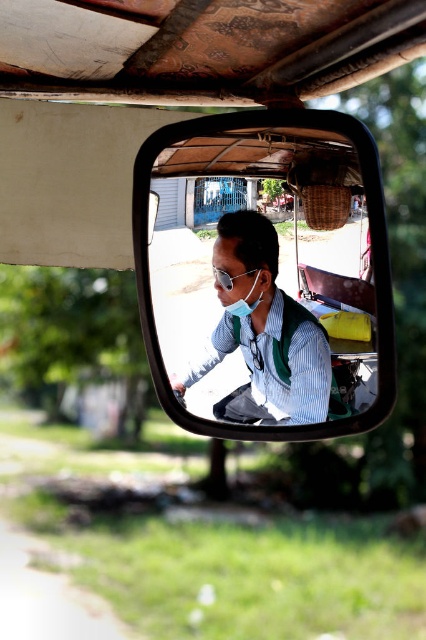
Who is more forward, (232, 310) or (229, 275)?

Point (232, 310) is more forward.

This screenshot has width=426, height=640. In order to click on green fabric mask at center in this screenshot , I will do `click(232, 288)`.

Can you confirm if clear plastic mirror at center is bigger than green fabric mask at center?

Correct, clear plastic mirror at center is larger in size than green fabric mask at center.

Can you confirm if clear plastic mirror at center is positioned to the right of green fabric mask at center?

Yes, clear plastic mirror at center is to the right of green fabric mask at center.

Is point (175, 228) more distant than point (247, 273)?

Yes, point (175, 228) is farther from viewer.

Where is `clear plastic mirror at center`? This screenshot has width=426, height=640. clear plastic mirror at center is located at coordinates (265, 275).

Can you confirm if clear plastic mirror at center is shorter than matte black shirt at center?

In fact, clear plastic mirror at center may be taller than matte black shirt at center.

Is clear plastic mirror at center positioned in front of matte black shirt at center?

Yes, it is.

Between point (356, 429) and point (261, 336), which one is positioned behind?

Positioned behind is point (356, 429).

Identify the location of clear plastic mirror at center. Image resolution: width=426 pixels, height=640 pixels. (265, 275).